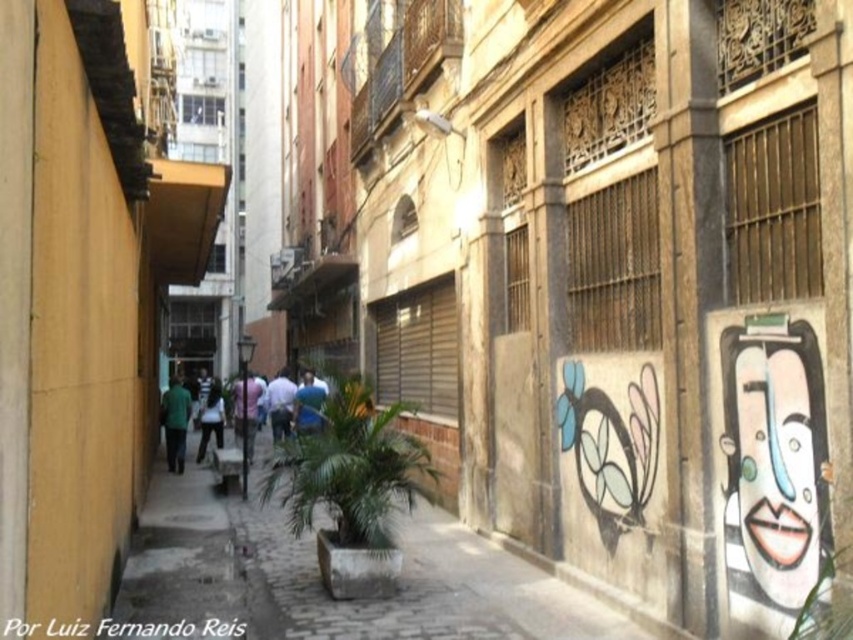
You are a graffiti artist planning to add a new mural to the wall with graffiti art at right. The existing white glossy face at right is located at point coordinates (776, 472). If you want to place a new red heart symbol 0.1 units to the right of the white glossy face at right, what would be the new coordinates for the center of the red heart symbol?

The new coordinates for the center of the red heart symbol would be approximately 0.838, 0.912. This is calculated by adding 0.1 to the x coordinate of the existing white glossy face at right, which is at (776, 472), resulting in 0.738 plus 0.1 equals 0.838 for the x value, while keeping the y coordinate the same at 0.912.

You are a muralist planning to add a new design to the alley. The white glossy face at right and the green matte shirt at center are existing artworks. If you want to place a new rectangular advertisement between them, which existing artwork should the ad be closer to to ensure it doesn

The ad should be placed closer to the green matte shirt at center because the white glossy face at right is smaller than the green matte shirt at center, meaning the shirt is larger and likely occupies more space, allowing the ad to fit better next to it.

Looking at this image, you are a window cleaner with a ladder. You need to clean the white glossy face at right and the blue fabric shirt at center. Which object should you clean first if you want to start from the lower one?

The blue fabric shirt at center should be cleaned first because it is lower than the white glossy face at right, which is positioned above it.